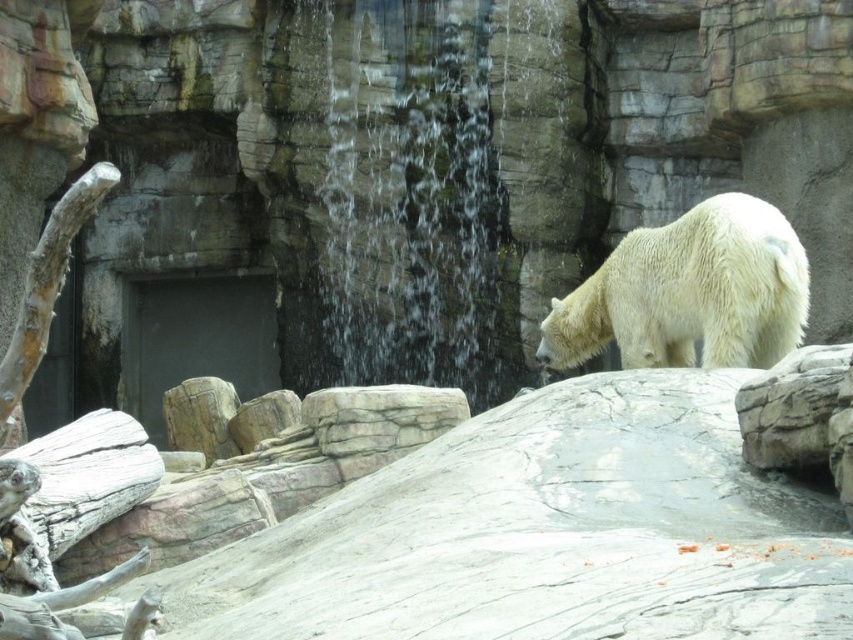
You are a zookeeper observing the polar bear enclosure. You need to determine if the white fluffy bear at right can drink from the clear water at center without climbing. Based on their heights, what do you think?

The clear water at center has a greater height compared to the white fluffy bear at right. Since the water is taller than the bear, it means the water level is higher than the bear, so the bear cannot drink from it without climbing.

You are a photographer standing in front of the polar bear enclosure. You want to take a photo that includes both the polar bear and the waterfall. The zoo has marked two points on the enclosure wall for safety reasons. The first point is at coordinate point (474, 349) and the second point is at coordinate point (625, 262). Which point is closer to you, the photographer?

Point (474, 349) is closer to you than point (625, 262) because it is further to the camera.

You are a zookeeper standing at the camera position. You need to place a new feeding station at the point that is exactly 60 meters away from your current position. Can you place it at the point labeled as point (403,29)?

The distance of point (403,29) from camera is 61.67 meters, so placing the feeding station there would be 1.67 meters too far from the desired 60 meters distance.